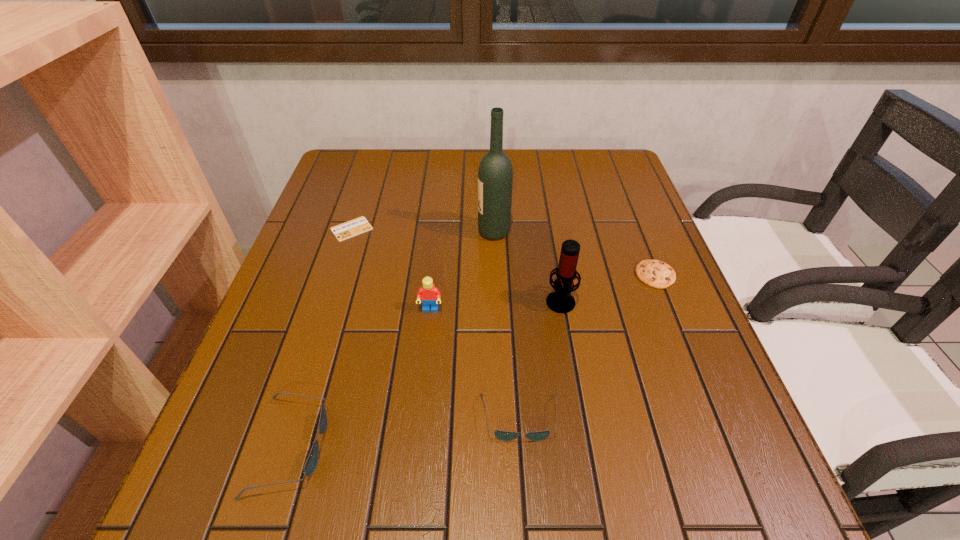
In the image, there is a desktop. Where is `free space at the far right corner`? The image size is (960, 540). free space at the far right corner is located at coordinates (621, 167).

Where is `blank region between the shortest object and the third object from left to right`? blank region between the shortest object and the third object from left to right is located at coordinates (391, 269).

Locate an element on the screen. The width and height of the screenshot is (960, 540). free space between the second tallest object and the right sunglasses is located at coordinates (540, 359).

Find the location of a particular element. The height and width of the screenshot is (540, 960). vacant space that's between the fourth tallest object and the tallest object is located at coordinates (393, 339).

The width and height of the screenshot is (960, 540). Identify the location of unoccupied position between the tallest object and the fourth tallest object. (393, 339).

I want to click on free space that is in between the sixth object from left to right and the left sunglasses, so click(425, 373).

At what (x,y) coordinates should I click in order to perform the action: click on free spot between the third object from left to right and the shorter sunglasses. Please return your answer as a coordinate pair (x, y). This screenshot has height=540, width=960. Looking at the image, I should click on (475, 364).

You are a GUI agent. You are given a task and a screenshot of the screen. Output one action in this format:
    pyautogui.click(x=<x>, y=<y>)
    Task: Click on the free space between the shorter sunglasses and the sixth shortest object
    The width and height of the screenshot is (960, 540).
    Given the screenshot: What is the action you would take?
    pyautogui.click(x=540, y=359)

Where is `free space between the identity card and the sixth tallest object`? This screenshot has width=960, height=540. free space between the identity card and the sixth tallest object is located at coordinates (503, 252).

This screenshot has height=540, width=960. In order to click on empty space that is in between the wine bottle and the shortest object in this screenshot , I will do `click(422, 230)`.